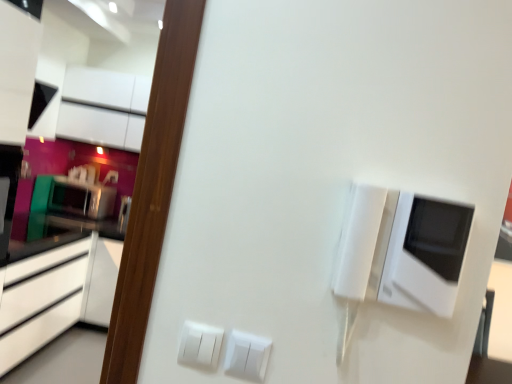
What are the coordinates of `satin black microwave at left, the first appliance when ordered from left to right` in the screenshot? It's located at (81, 198).

Where is `white plastic switch at lower center, marked as the 2th electric outlet in a right-to-left arrangement`? white plastic switch at lower center, marked as the 2th electric outlet in a right-to-left arrangement is located at coordinates (200, 344).

Describe the element at coordinates (103, 107) in the screenshot. I see `white glossy cabinetry at upper left, which is the second cabinetry in bottom-to-top order` at that location.

I want to click on white glossy cabinetry at left, the first cabinetry positioned from the bottom, so click(41, 300).

Considering the relative sizes of matte black cabinet at upper left, the 3th cabinetry positioned from the bottom, and white glossy cabinetry at upper left, acting as the 2th cabinetry starting from the top, in the image provided, is matte black cabinet at upper left, the 3th cabinetry positioned from the bottom, smaller than white glossy cabinetry at upper left, acting as the 2th cabinetry starting from the top,?

No, matte black cabinet at upper left, the 3th cabinetry positioned from the bottom, is not smaller than white glossy cabinetry at upper left, acting as the 2th cabinetry starting from the top.

In the image, is matte black cabinet at upper left, arranged as the 1th cabinetry when viewed from the top, on the left side or the right side of white glossy cabinetry at upper left, which is the second cabinetry in bottom-to-top order?

Clearly, matte black cabinet at upper left, arranged as the 1th cabinetry when viewed from the top, is on the left of white glossy cabinetry at upper left, which is the second cabinetry in bottom-to-top order, in the image.

Looking at this image, considering the sizes of objects matte black cabinet at upper left, the 3th cabinetry positioned from the bottom, and white glossy cabinetry at upper left, acting as the 2th cabinetry starting from the top, in the image provided, who is thinner, matte black cabinet at upper left, the 3th cabinetry positioned from the bottom, or white glossy cabinetry at upper left, acting as the 2th cabinetry starting from the top,?

white glossy cabinetry at upper left, acting as the 2th cabinetry starting from the top, is thinner.

From the image's perspective, is matte black cabinet at upper left, arranged as the 1th cabinetry when viewed from the top, located above or below white glossy cabinetry at upper left, acting as the 2th cabinetry starting from the top?

Based on their image positions, matte black cabinet at upper left, arranged as the 1th cabinetry when viewed from the top, is located above white glossy cabinetry at upper left, acting as the 2th cabinetry starting from the top.

Considering the sizes of white glossy microwave at upper right, the 2th appliance in the back-to-front sequence, and satin black microwave at left, the first appliance from the back, in the image, is white glossy microwave at upper right, the 2th appliance in the back-to-front sequence, wider or thinner than satin black microwave at left, the first appliance from the back,?

In the image, white glossy microwave at upper right, the 2th appliance in the back-to-front sequence, appears to be more narrow than satin black microwave at left, the first appliance from the back.

Considering the sizes of objects white glossy microwave at upper right, the first appliance from the right, and satin black microwave at left, the first appliance from the back, in the image provided, who is smaller, white glossy microwave at upper right, the first appliance from the right, or satin black microwave at left, the first appliance from the back,?

white glossy microwave at upper right, the first appliance from the right.

Is white glossy microwave at upper right, the first appliance positioned from the front, to the left of satin black microwave at left, the first appliance from the back, from the viewer's perspective?

Incorrect, white glossy microwave at upper right, the first appliance positioned from the front, is not on the left side of satin black microwave at left, the first appliance from the back.

Which is in front, white glossy microwave at upper right, the first appliance from the right, or satin black microwave at left, the first appliance from the back?

white glossy microwave at upper right, the first appliance from the right, is in front.

From a real-world perspective, relative to white glossy microwave at upper right, the first appliance positioned from the front, is matte black cabinet at upper left, the 3th cabinetry positioned from the bottom, vertically above or below?

matte black cabinet at upper left, the 3th cabinetry positioned from the bottom, is above white glossy microwave at upper right, the first appliance positioned from the front.

Is matte black cabinet at upper left, arranged as the 1th cabinetry when viewed from the top, turned away from white glossy microwave at upper right, the first appliance positioned from the front?

No, matte black cabinet at upper left, arranged as the 1th cabinetry when viewed from the top,'s orientation is not away from white glossy microwave at upper right, the first appliance positioned from the front.

Does matte black cabinet at upper left, the 3th cabinetry positioned from the bottom, appear on the right side of white glossy microwave at upper right, the 2th appliance in the back-to-front sequence?

Incorrect, matte black cabinet at upper left, the 3th cabinetry positioned from the bottom, is not on the right side of white glossy microwave at upper right, the 2th appliance in the back-to-front sequence.

From the image's perspective, which appliance is the 2nd one below the matte black cabinet at upper left, arranged as the 1th cabinetry when viewed from the top? Please provide its 2D coordinates.

[(402, 249)]

You are a GUI agent. You are given a task and a screenshot of the screen. Output one action in this format:
    pyautogui.click(x=<x>, y=<y>)
    Task: Click on the cabinetry that is the 1st object located behind the white plastic switch at lower center, placed as the 2th electric outlet when sorted from left to right
    
    Given the screenshot: What is the action you would take?
    pyautogui.click(x=41, y=300)

Is the position of white plastic switch at lower center, the first electric outlet positioned from the right, more distant than that of white glossy cabinetry at left, the first cabinetry positioned from the bottom?

No, the depth of white plastic switch at lower center, the first electric outlet positioned from the right, is less than that of white glossy cabinetry at left, the first cabinetry positioned from the bottom.

How distant is white plastic switch at lower center, the first electric outlet positioned from the right, from white glossy cabinetry at left, placed as the third cabinetry when sorted from top to bottom?

white plastic switch at lower center, the first electric outlet positioned from the right, is 7.84 feet from white glossy cabinetry at left, placed as the third cabinetry when sorted from top to bottom.

From a real-world perspective, is white plastic switch at lower center, placed as the 2th electric outlet when sorted from left to right, positioned over white glossy cabinetry at left, the first cabinetry positioned from the bottom, based on gravity?

Indeed, from a real-world perspective, white plastic switch at lower center, placed as the 2th electric outlet when sorted from left to right, stands above white glossy cabinetry at left, the first cabinetry positioned from the bottom.

Does white glossy cabinetry at left, the first cabinetry positioned from the bottom, lie behind white plastic switch at lower center, the first electric outlet viewed from the left?

Yes, it is behind white plastic switch at lower center, the first electric outlet viewed from the left.

Who is smaller, white glossy cabinetry at left, the first cabinetry positioned from the bottom, or white plastic switch at lower center, marked as the 2th electric outlet in a right-to-left arrangement?

white plastic switch at lower center, marked as the 2th electric outlet in a right-to-left arrangement, is smaller.

Between white glossy cabinetry at left, the first cabinetry positioned from the bottom, and white plastic switch at lower center, the first electric outlet viewed from the left, which one has more height?

white glossy cabinetry at left, the first cabinetry positioned from the bottom, is taller.

Can you confirm if white glossy cabinetry at left, placed as the third cabinetry when sorted from top to bottom, is thinner than white plastic switch at lower center, marked as the 2th electric outlet in a right-to-left arrangement?

No.

This screenshot has height=384, width=512. I want to click on the 3rd cabinetry counting from the left of the white glossy microwave at upper right, the first appliance positioned from the front, so click(41, 300).

Is white glossy cabinetry at left, the first cabinetry positioned from the bottom, smaller than white glossy microwave at upper right, the first appliance from the right?

No, white glossy cabinetry at left, the first cabinetry positioned from the bottom, is not smaller than white glossy microwave at upper right, the first appliance from the right.

Is white glossy cabinetry at left, placed as the third cabinetry when sorted from top to bottom, oriented towards white glossy microwave at upper right, the first appliance from the right?

No.

From the image's perspective, between white glossy cabinetry at left, placed as the third cabinetry when sorted from top to bottom, and white glossy microwave at upper right, the first appliance from the right, which one is located above?

white glossy microwave at upper right, the first appliance from the right, from the image's perspective.

From a real-world perspective, is white plastic switch at lower center, the first electric outlet positioned from the right, over white glossy cabinetry at upper left, acting as the 2th cabinetry starting from the top?

No, from a real-world perspective, white plastic switch at lower center, the first electric outlet positioned from the right, is not above white glossy cabinetry at upper left, acting as the 2th cabinetry starting from the top.

Is point (249, 346) in front of point (75, 125)?

Yes.

Can you confirm if white plastic switch at lower center, placed as the 2th electric outlet when sorted from left to right, is thinner than white glossy cabinetry at upper left, which is the second cabinetry in bottom-to-top order?

Yes, white plastic switch at lower center, placed as the 2th electric outlet when sorted from left to right, is thinner than white glossy cabinetry at upper left, which is the second cabinetry in bottom-to-top order.

Is white plastic switch at lower center, placed as the 2th electric outlet when sorted from left to right, far away from white glossy cabinetry at upper left, acting as the 2th cabinetry starting from the top?

Absolutely, white plastic switch at lower center, placed as the 2th electric outlet when sorted from left to right, is distant from white glossy cabinetry at upper left, acting as the 2th cabinetry starting from the top.

The image size is (512, 384). What are the coordinates of `cabinetry that is the 1st object located in front of the white glossy cabinetry at upper left, which is the second cabinetry in bottom-to-top order` in the screenshot? It's located at (17, 70).

Where is `appliance beneath the white glossy microwave at upper right, the first appliance positioned from the front (from a real-world perspective)`? Image resolution: width=512 pixels, height=384 pixels. appliance beneath the white glossy microwave at upper right, the first appliance positioned from the front (from a real-world perspective) is located at coordinates (81, 198).

Which object lies nearer to the anchor point white glossy microwave at upper right, the 2th appliance in the back-to-front sequence, white glossy cabinetry at left, the first cabinetry positioned from the bottom, or matte black cabinet at upper left, the 3th cabinetry positioned from the bottom?

Based on the image, matte black cabinet at upper left, the 3th cabinetry positioned from the bottom, appears to be nearer to white glossy microwave at upper right, the 2th appliance in the back-to-front sequence.

Looking at the image, which one is located further to white glossy cabinetry at upper left, acting as the 2th cabinetry starting from the top, matte black cabinet at upper left, arranged as the 1th cabinetry when viewed from the top, or satin black microwave at left, the first appliance when ordered from left to right?

The object further to white glossy cabinetry at upper left, acting as the 2th cabinetry starting from the top, is matte black cabinet at upper left, arranged as the 1th cabinetry when viewed from the top.

From the image, which object appears to be farther from matte black cabinet at upper left, arranged as the 1th cabinetry when viewed from the top, white glossy microwave at upper right, the 2th appliance in the back-to-front sequence, or white plastic switch at lower center, the first electric outlet viewed from the left?

Among the two, white glossy microwave at upper right, the 2th appliance in the back-to-front sequence, is located further to matte black cabinet at upper left, arranged as the 1th cabinetry when viewed from the top.

Considering their positions, is satin black microwave at left, which is counted as the 2th appliance, starting from the front, positioned closer to white glossy microwave at upper right, the first appliance positioned from the front, than white plastic switch at lower center, the first electric outlet positioned from the right?

white plastic switch at lower center, the first electric outlet positioned from the right, is closer to white glossy microwave at upper right, the first appliance positioned from the front.

Estimate the real-world distances between objects in this image. Which object is further from white plastic switch at lower center, the first electric outlet positioned from the right, satin black microwave at left, which is counted as the 2th appliance, starting from the front, or white plastic switch at lower center, marked as the 2th electric outlet in a right-to-left arrangement?

Based on the image, satin black microwave at left, which is counted as the 2th appliance, starting from the front, appears to be further to white plastic switch at lower center, the first electric outlet positioned from the right.

Based on their spatial positions, is white glossy cabinetry at left, placed as the third cabinetry when sorted from top to bottom, or white plastic switch at lower center, the first electric outlet positioned from the right, closer to white glossy cabinetry at upper left, acting as the 2th cabinetry starting from the top?

white glossy cabinetry at left, placed as the third cabinetry when sorted from top to bottom.

Based on the photo, considering their positions, is white glossy microwave at upper right, the 2th appliance in the back-to-front sequence, positioned further to white plastic switch at lower center, the first electric outlet viewed from the left, than white glossy cabinetry at upper left, which is the second cabinetry in bottom-to-top order?

white glossy cabinetry at upper left, which is the second cabinetry in bottom-to-top order, is further to white plastic switch at lower center, the first electric outlet viewed from the left.

Based on their spatial positions, is matte black cabinet at upper left, arranged as the 1th cabinetry when viewed from the top, or white glossy cabinetry at left, the first cabinetry positioned from the bottom, closer to white plastic switch at lower center, the first electric outlet viewed from the left?

matte black cabinet at upper left, arranged as the 1th cabinetry when viewed from the top, is positioned closer to the anchor white plastic switch at lower center, the first electric outlet viewed from the left.

The width and height of the screenshot is (512, 384). I want to click on cabinetry between white plastic switch at lower center, the first electric outlet positioned from the right, and matte black cabinet at upper left, the 3th cabinetry positioned from the bottom, from front to back, so click(41, 300).

Find the location of a particular element. This screenshot has height=384, width=512. electric outlet between white plastic switch at lower center, the first electric outlet viewed from the left, and white glossy microwave at upper right, the first appliance from the right, in the horizontal direction is located at coordinates (247, 355).

Identify the location of cabinetry between matte black cabinet at upper left, the 3th cabinetry positioned from the bottom, and satin black microwave at left, the second appliance from the right, in the front-back direction. [103, 107].

Find the location of `electric outlet positioned between white plastic switch at lower center, placed as the 2th electric outlet when sorted from left to right, and satin black microwave at left, the second appliance from the right, from near to far`. electric outlet positioned between white plastic switch at lower center, placed as the 2th electric outlet when sorted from left to right, and satin black microwave at left, the second appliance from the right, from near to far is located at coordinates (200, 344).